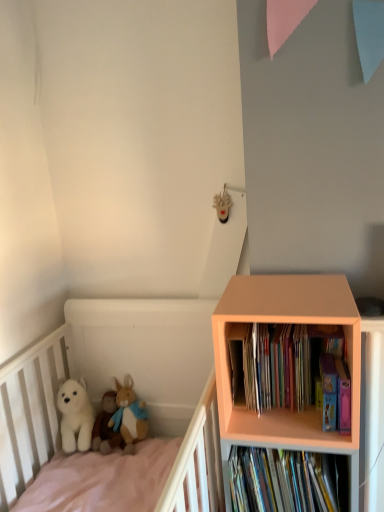
What are the coordinates of `free space above peach wood bookcase at right (from a real-world perspective)` in the screenshot? It's located at (279, 290).